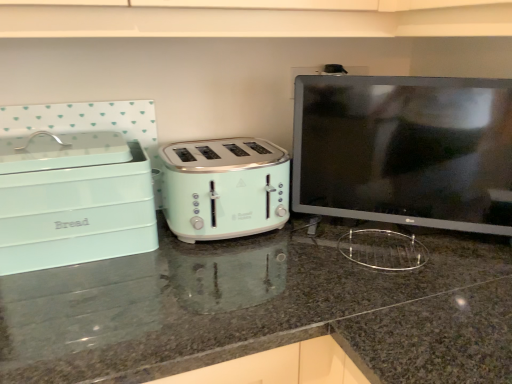
The image size is (512, 384). In order to click on free space above matte black monitor at right (from a real-world perspective) in this screenshot , I will do [409, 84].